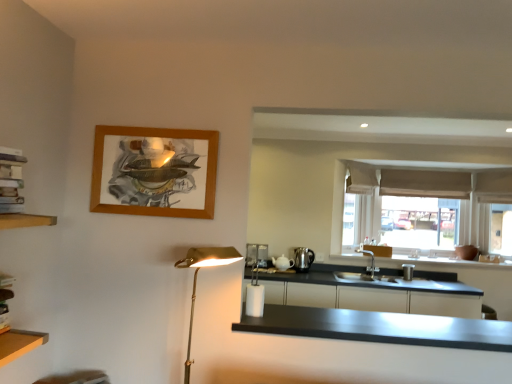
Question: From the image's perspective, relative to beige fabric curtain at upper right, is matte black cabinetry at lower right above or below?

Choices:
 (A) above
 (B) below

Answer: (B)

Question: Do you think matte black cabinetry at lower right is within beige fabric curtain at upper right, or outside of it?

Choices:
 (A) outside
 (B) inside

Answer: (A)

Question: Considering the real-world distances, which object is closest to the gold metallic floor lamp at left?

Choices:
 (A) black matte countertop at center
 (B) white ceramic teapot at upper right, which is counted as the first appliance, starting from the left
 (C) beige fabric window at center
 (D) wooden frame at upper left
 (E) matte black cabinetry at lower right

Answer: (D)

Question: Which object is positioned closest to the beige fabric window at center?

Choices:
 (A) beige fabric curtain at upper right
 (B) matte black cabinetry at lower right
 (C) wooden frame at upper left
 (D) white cardboard books at left
 (E) black matte countertop at center

Answer: (A)